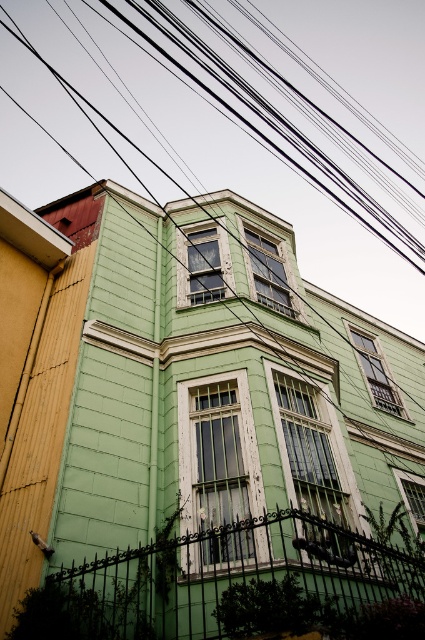
Question: Which point is closer to the camera?

Choices:
 (A) black wires at upper center
 (B) green matte window at center

Answer: (B)

Question: Can you confirm if black wires at upper center is wider than green painted glass window at center?

Choices:
 (A) yes
 (B) no

Answer: (A)

Question: Which point is closer to the camera taking this photo?

Choices:
 (A) (354, 42)
 (B) (359, 342)
 (C) (197, 298)
 (D) (275, 308)

Answer: (C)

Question: Is black wires at upper center in front of green painted glass window at center?

Choices:
 (A) no
 (B) yes

Answer: (A)

Question: Among these objects, which one is farthest from the camera?

Choices:
 (A) matte glass window at upper center
 (B) green painted glass window at center
 (C) green painted wood window at center
 (D) white wooden window at center

Answer: (C)

Question: Does matte glass window at upper center come in front of green matte window at center?

Choices:
 (A) yes
 (B) no

Answer: (B)